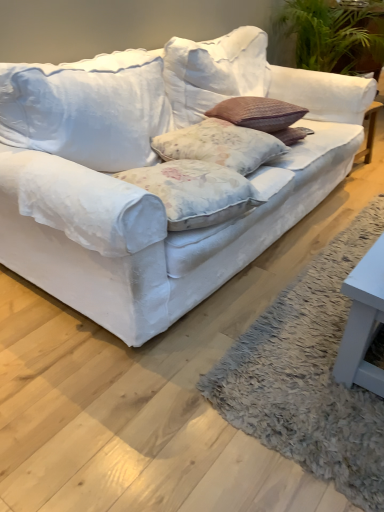
Question: From a real-world perspective, is floral fabric pillow at center positioned above or below white fabric couch at center?

Choices:
 (A) below
 (B) above

Answer: (B)

Question: Is floral fabric pillow at center in front of or behind white fabric couch at center in the image?

Choices:
 (A) behind
 (B) front

Answer: (A)

Question: Is point (228, 126) positioned closer to the camera than point (127, 215)?

Choices:
 (A) farther
 (B) closer

Answer: (A)

Question: In terms of height, does white fabric couch at center look taller or shorter compared to floral fabric pillow at center?

Choices:
 (A) short
 (B) tall

Answer: (B)

Question: Is point (339, 181) positioned closer to the camera than point (195, 138)?

Choices:
 (A) farther
 (B) closer

Answer: (A)

Question: In terms of width, does white fabric couch at center look wider or thinner when compared to floral fabric pillow at center?

Choices:
 (A) thin
 (B) wide

Answer: (B)

Question: From the image's perspective, is white fabric couch at center positioned above or below floral fabric pillow at center?

Choices:
 (A) above
 (B) below

Answer: (A)